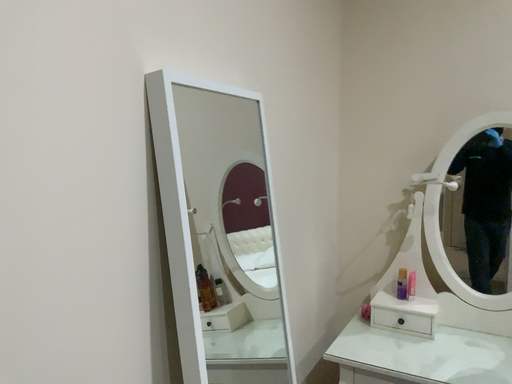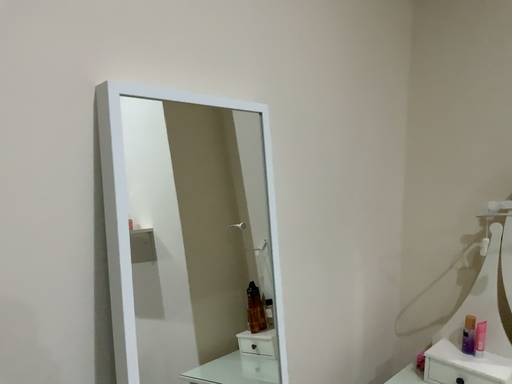
Question: Which way did the camera rotate in the video?

Choices:
 (A) rotated left
 (B) rotated right

Answer: (A)